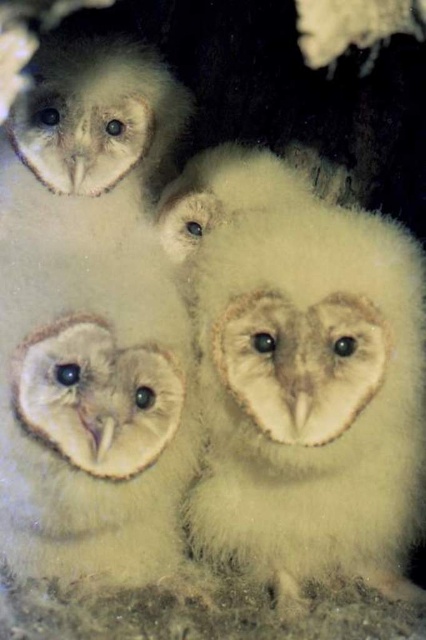
You are an animal caretaker observing the baby owls. You notice a specific point in the image at coordinates point (311, 396). Which baby owl does this point correspond to?

The point (311, 396) corresponds to the soft white fur owl at center.

You are a wildlife photographer trying to capture a closeup of the soft white fur owl at center and the soft white feathers at upper center in the image. Given that your camera can focus on objects within a 15 inch range, will you be able to capture both in one shot?

The soft white fur owl at center and the soft white feathers at upper center are 16.48 inches apart, which is beyond the camera focus range of 15 inches. Therefore, you cannot capture both in one shot.

You are a birdwatcher observing the baby owls. You notice two features in the image. One is the soft white fur owl at center and the other is the soft white feathers at upper center. Which one is positioned to the right of the other?

The soft white fur owl at center is positioned to the right of the soft white feathers at upper center.